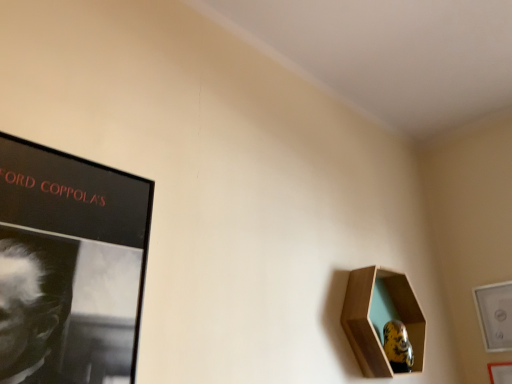
Question: In terms of height, does white glossy picture frame at lower right, placed as the 2th picture frame when sorted from left to right, look taller or shorter compared to wooden hexagonal frame at lower right, which is the 1th picture frame in left-to-right order?

Choices:
 (A) tall
 (B) short

Answer: (B)

Question: Visually, is white glossy picture frame at lower right, the second picture frame when ordered from right to left, positioned to the left or to the right of wooden hexagonal frame at lower right, marked as the third picture frame in a right-to-left arrangement?

Choices:
 (A) right
 (B) left

Answer: (A)

Question: Which object is the farthest from the wooden picture frame at lower right, marked as the third picture frame in a left-to-right arrangement?

Choices:
 (A) wooden hexagonal frame at lower right, marked as the third picture frame in a right-to-left arrangement
 (B) white glossy picture frame at lower right, the second picture frame when ordered from right to left

Answer: (A)

Question: Which is nearer to the wooden hexagonal frame at lower right, which is the 1th picture frame in left-to-right order?

Choices:
 (A) wooden picture frame at lower right, marked as the third picture frame in a left-to-right arrangement
 (B) white glossy picture frame at lower right, the second picture frame when ordered from right to left

Answer: (B)